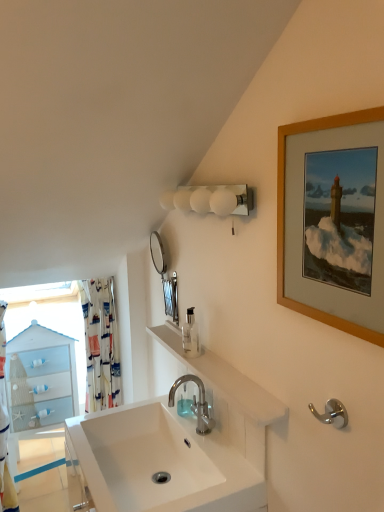
Question: Is wooden picture frame at upper right further to camera compared to clear plastic soap dispenser at center?

Choices:
 (A) yes
 (B) no

Answer: (B)

Question: Is clear plastic soap dispenser at center inside wooden picture frame at upper right?

Choices:
 (A) no
 (B) yes

Answer: (A)

Question: Is wooden picture frame at upper right wider than clear plastic soap dispenser at center?

Choices:
 (A) yes
 (B) no

Answer: (B)

Question: Is wooden picture frame at upper right thinner than clear plastic soap dispenser at center?

Choices:
 (A) no
 (B) yes

Answer: (B)

Question: Is wooden picture frame at upper right turned away from clear plastic soap dispenser at center?

Choices:
 (A) yes
 (B) no

Answer: (B)

Question: Can we say wooden picture frame at upper right lies outside clear plastic soap dispenser at center?

Choices:
 (A) no
 (B) yes

Answer: (B)

Question: Does silver metallic mirror at upper center have a greater width compared to polished chrome faucet at center?

Choices:
 (A) yes
 (B) no

Answer: (B)

Question: From a real-world perspective, is silver metallic mirror at upper center on polished chrome faucet at center?

Choices:
 (A) yes
 (B) no

Answer: (A)

Question: From the image's perspective, is silver metallic mirror at upper center below polished chrome faucet at center?

Choices:
 (A) no
 (B) yes

Answer: (A)

Question: Is silver metallic mirror at upper center in contact with polished chrome faucet at center?

Choices:
 (A) yes
 (B) no

Answer: (B)

Question: Does silver metallic mirror at upper center have a smaller size compared to polished chrome faucet at center?

Choices:
 (A) yes
 (B) no

Answer: (A)

Question: Is silver metallic mirror at upper center far away from polished chrome faucet at center?

Choices:
 (A) no
 (B) yes

Answer: (A)

Question: Is polished chrome hook at lower right facing away from white frosted glass sconce at upper center?

Choices:
 (A) yes
 (B) no

Answer: (B)